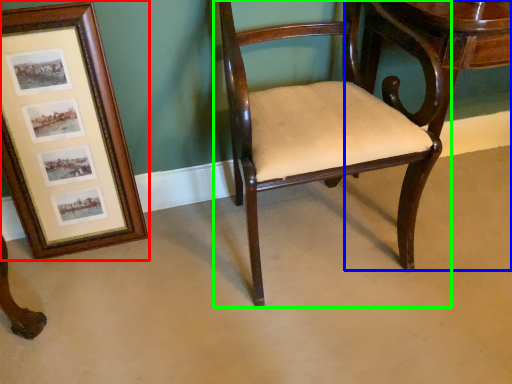
Question: Estimate the real-world distances between objects in this image. Which object is farther from picture frame (highlighted by a red box), table (highlighted by a blue box) or chair (highlighted by a green box)?

Choices:
 (A) table
 (B) chair

Answer: (A)